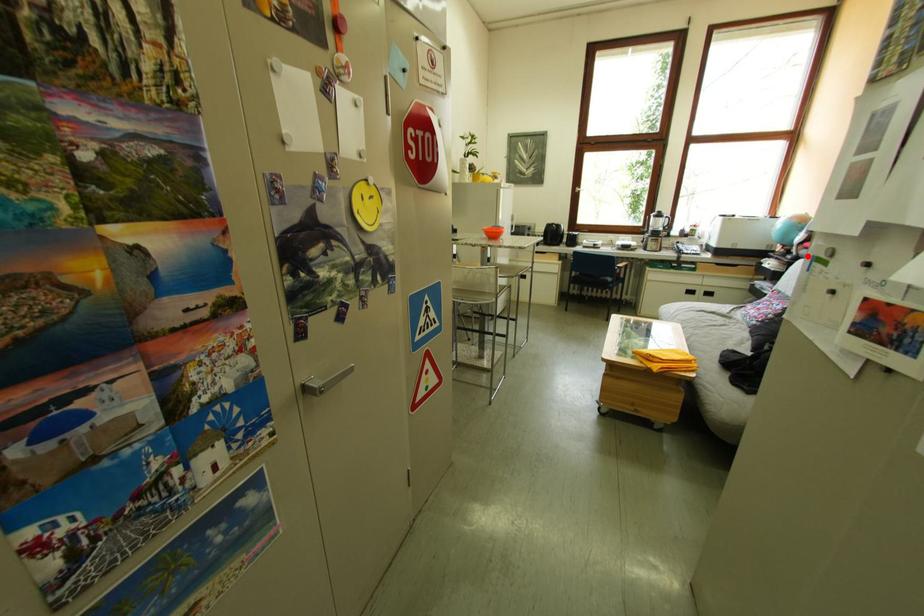
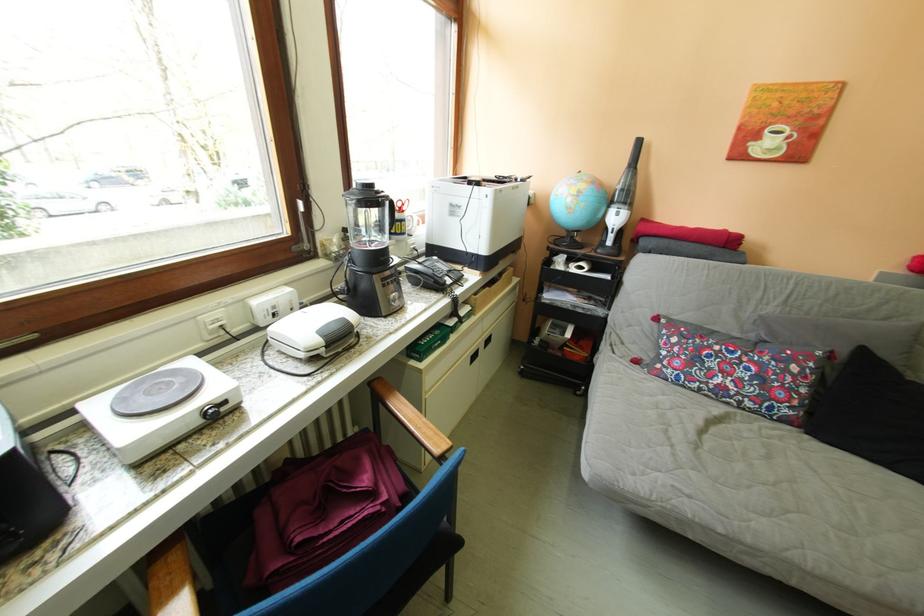
Where in the second image is the point corresponding to the highlighted location from the first image?

(622, 246)